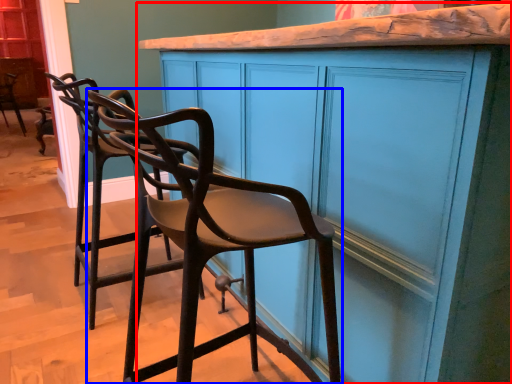
Question: Which point is closer to the camera, cabinetry (highlighted by a red box) or chair (highlighted by a blue box)?

Choices:
 (A) cabinetry
 (B) chair

Answer: (B)